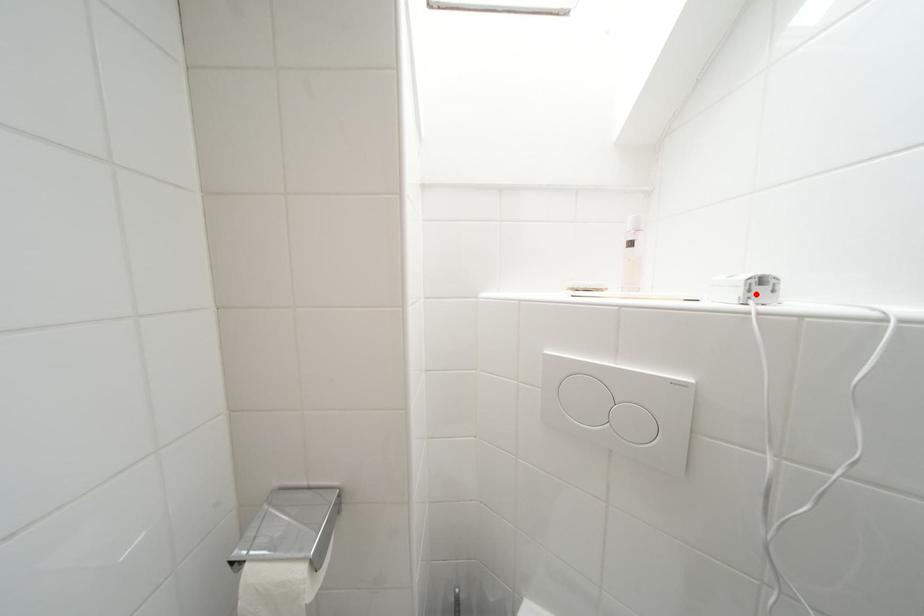
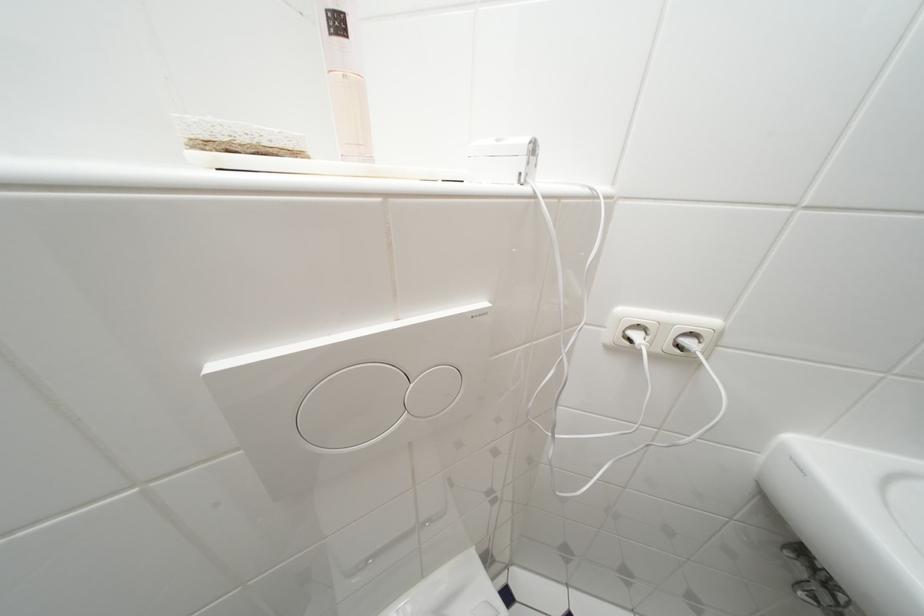
The point at the highlighted location is marked in the first image. Where is the corresponding point in the second image?

(535, 166)